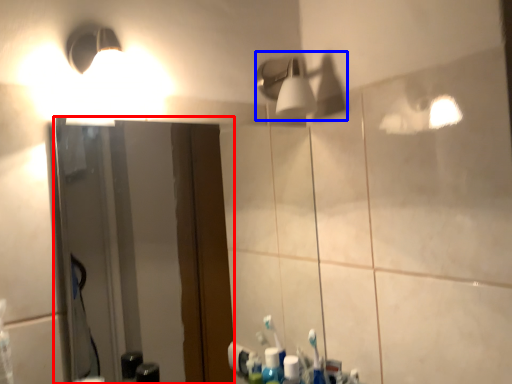
Question: Which object appears farthest to the camera in this image, mirror (highlighted by a red box) or light fixture (highlighted by a blue box)?

Choices:
 (A) mirror
 (B) light fixture

Answer: (B)